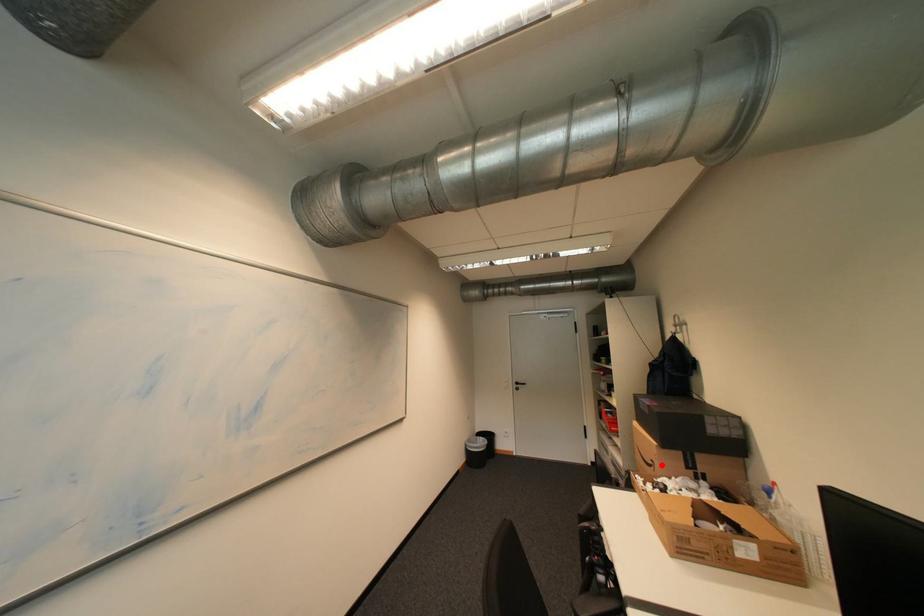
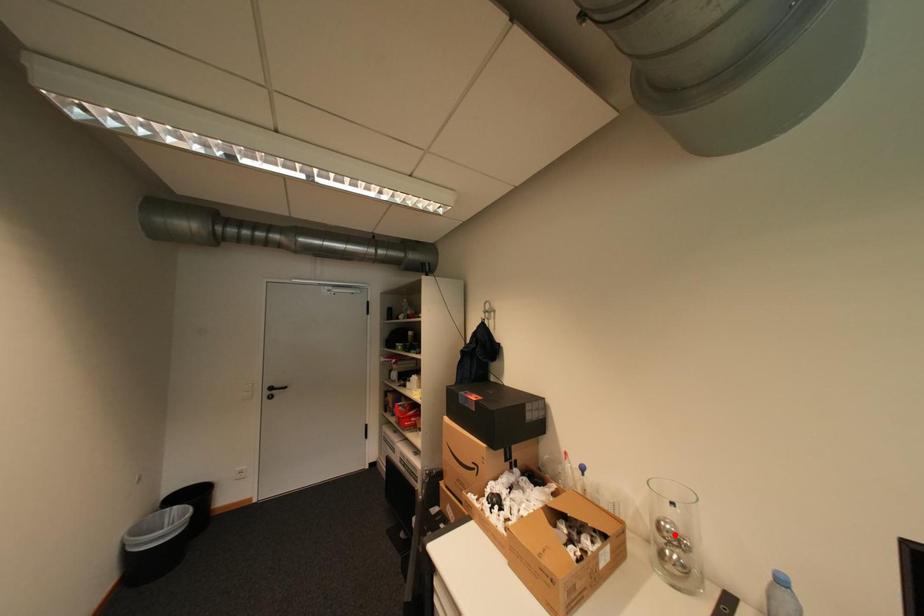
I am providing you with two images of the same scene from different viewpoints. A red point is marked on the first image and another point is marked on the second image. Is the red point in image1 aligned with the point shown in image2?

No